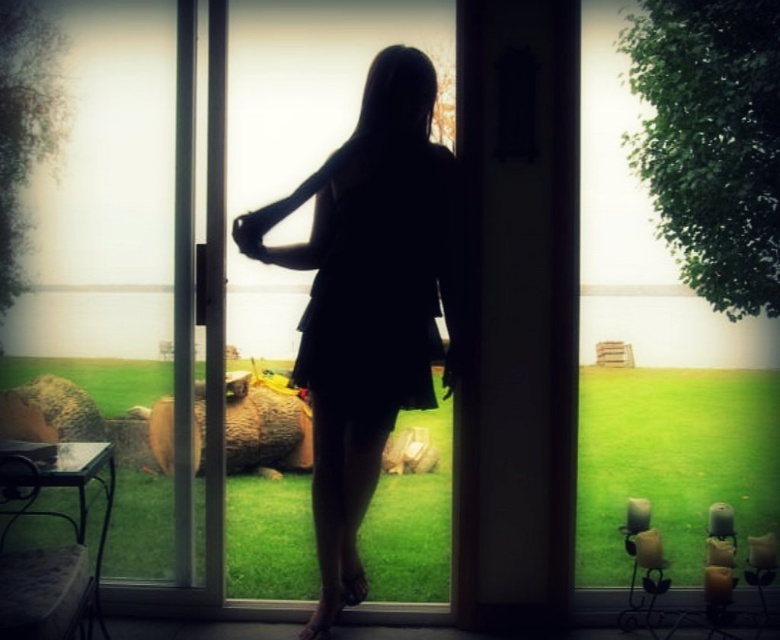
You are a delivery robot with a package that is 1.2 meters wide. You need to deliver it through the transparent glass window at center to the person in the silhouette dress at center. Can you fit the package through the space between them?

The transparent glass window at center and silhouette dress at center are 1.04 meters apart. Since the package is 1.2 meters wide, it cannot fit through the space between them as the gap is narrower than the package.

You are standing in a room and want to exit through the transparent glass window at center. However, you notice the silhouette dress at center is blocking your path. Based on their positions, can you move around the dress to reach the window?

The transparent glass window at center is positioned on the right side of the silhouette dress at center, so you can move around to the right side of the silhouette dress at center to reach the transparent glass window at center.